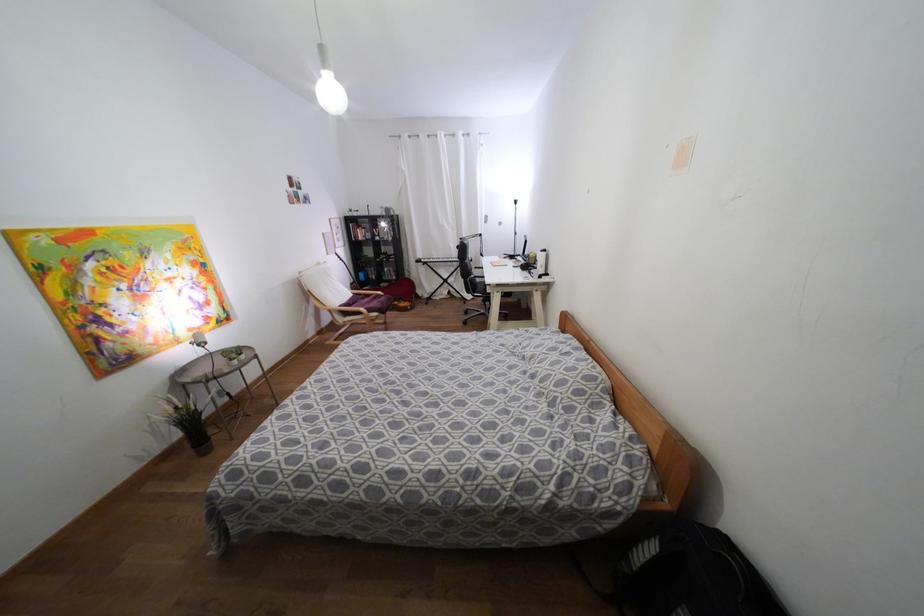
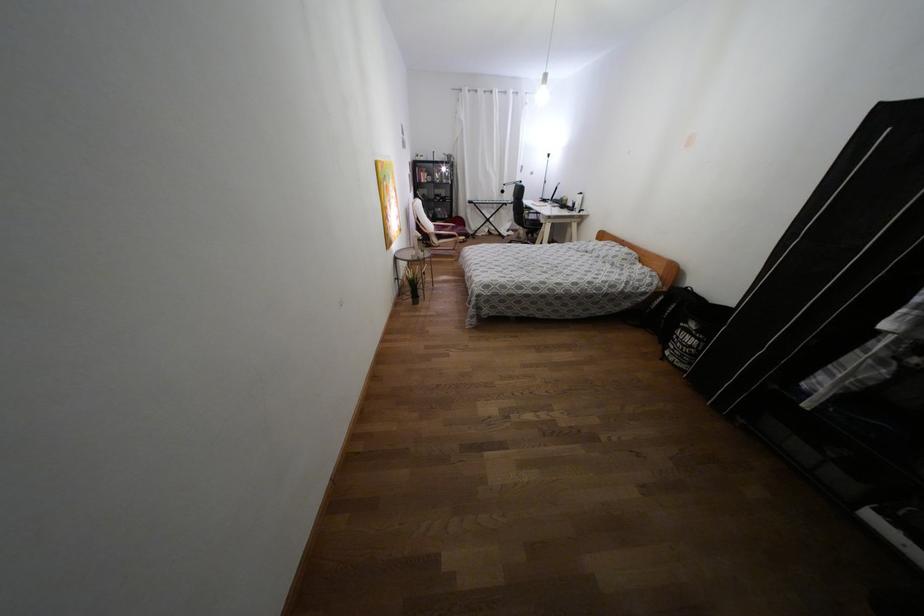
Find the pixel in the second image that matches the point at 489,293 in the first image.

(541, 224)